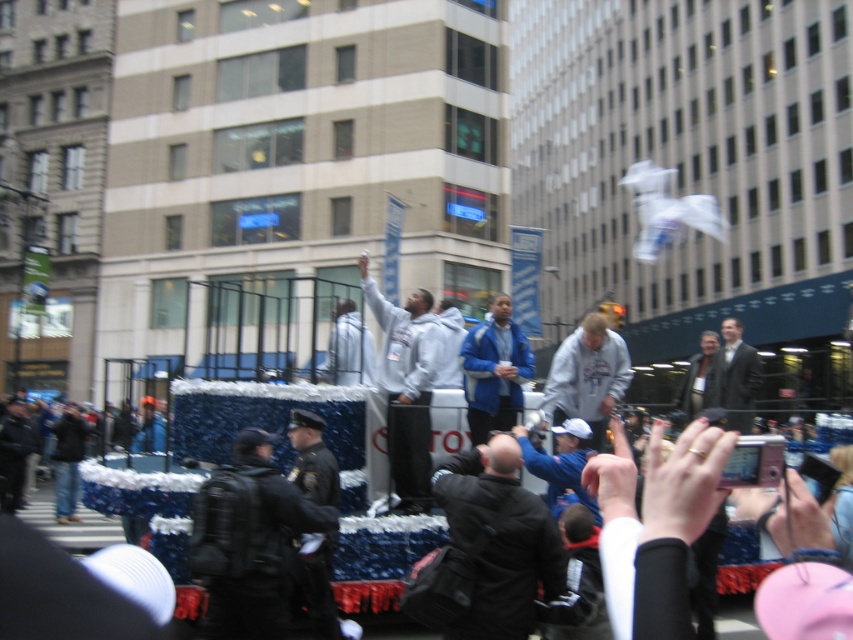
Question: Is dark gray suit at center positioned behind light brown leather jacket at center?

Choices:
 (A) no
 (B) yes

Answer: (A)

Question: Which point appears farthest from the camera in this image?

Choices:
 (A) (416, 499)
 (B) (517, 596)
 (C) (291, 436)

Answer: (A)

Question: Which point is closer to the camera?

Choices:
 (A) (477, 372)
 (B) (601, 374)
 (C) (202, 628)

Answer: (C)

Question: Can you confirm if gray hoodie at center is thinner than blue jacket at center?

Choices:
 (A) yes
 (B) no

Answer: (B)

Question: Among these objects, which one is farthest from the camera?

Choices:
 (A) blue jacket at center
 (B) gray hoodie at center
 (C) gray fleece sweatshirt at center

Answer: (A)

Question: Does black leather jacket at center have a lesser width compared to light brown leather jacket at center?

Choices:
 (A) no
 (B) yes

Answer: (B)